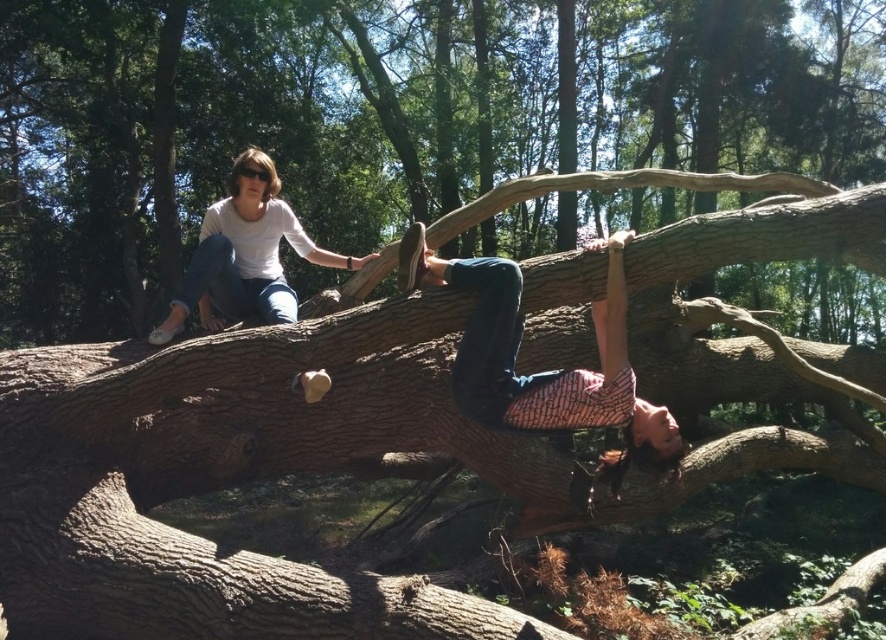
Question: Is patterned fabric shirt at upper center closer to the viewer compared to white matte shirt at upper left?

Choices:
 (A) yes
 (B) no

Answer: (A)

Question: Is the position of patterned fabric shirt at upper center more distant than that of white matte shirt at upper left?

Choices:
 (A) yes
 (B) no

Answer: (B)

Question: Which point is closer to the camera?

Choices:
 (A) white matte shirt at upper left
 (B) patterned fabric shirt at upper center

Answer: (B)

Question: Where is patterned fabric shirt at upper center located in relation to white matte shirt at upper left in the image?

Choices:
 (A) above
 (B) below

Answer: (B)